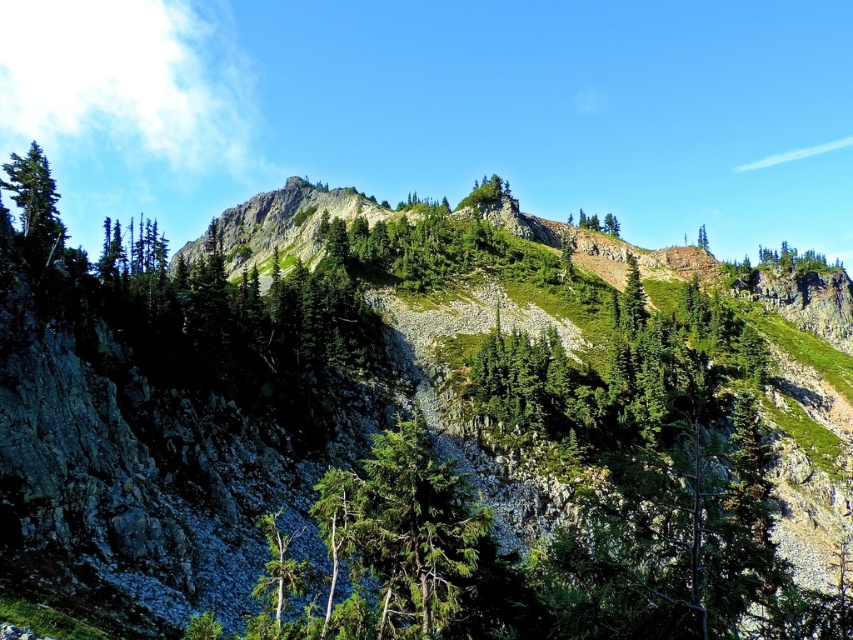
Question: Does green matte tree at center appear under green matte tree at upper left?

Choices:
 (A) yes
 (B) no

Answer: (A)

Question: Does green grassy hillside at upper center have a smaller size compared to green matte tree at upper left?

Choices:
 (A) yes
 (B) no

Answer: (A)

Question: Does green grassy hillside at upper center have a larger size compared to green matte tree at upper center?

Choices:
 (A) no
 (B) yes

Answer: (B)

Question: Which point is closer to the camera taking this photo?

Choices:
 (A) (45, 205)
 (B) (700, 234)
 (C) (260, 580)

Answer: (C)

Question: Which object is positioned closest to the green matte tree at upper left?

Choices:
 (A) green matte tree at upper center
 (B) green leafy tree at upper center

Answer: (B)

Question: Among these points, which one is farthest from the camera?

Choices:
 (A) (39, 221)
 (B) (602, 228)
 (C) (260, 525)
 (D) (705, 236)

Answer: (B)